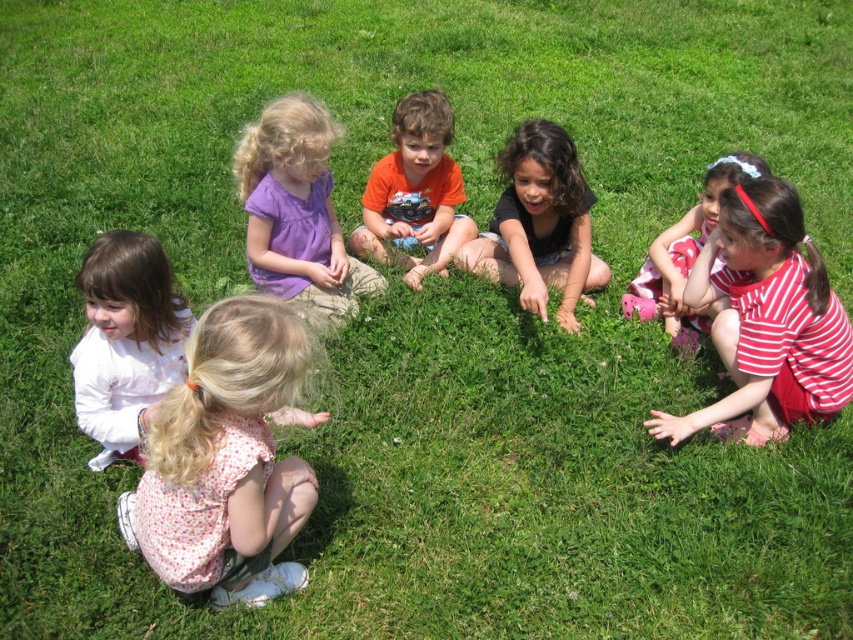
You are a photographer trying to capture a photo of the striped fabric dress at upper right without including the white matte shirt at lower left in the frame. Based on their positions, is this possible?

The white matte shirt at lower left is to the left of the striped fabric dress at upper right, so if you position yourself to the left side of the white matte shirt at lower left, you can frame the striped fabric dress at upper right without including the white matte shirt at lower left.

You are a photographer standing at the edge of the grassy area. You want to take a group photo of the purple cotton shirt at upper center and the striped fabric dress at upper right without any obstructions. Given that your camera has a minimum focus distance of 1.5 meters, will you be able to capture both subjects clearly in the frame?

The distance between the purple cotton shirt at upper center and the striped fabric dress at upper right is 1.59 meters. Since the minimum focus distance of your camera is 1.5 meters, you can capture both subjects clearly as the distance is sufficient.